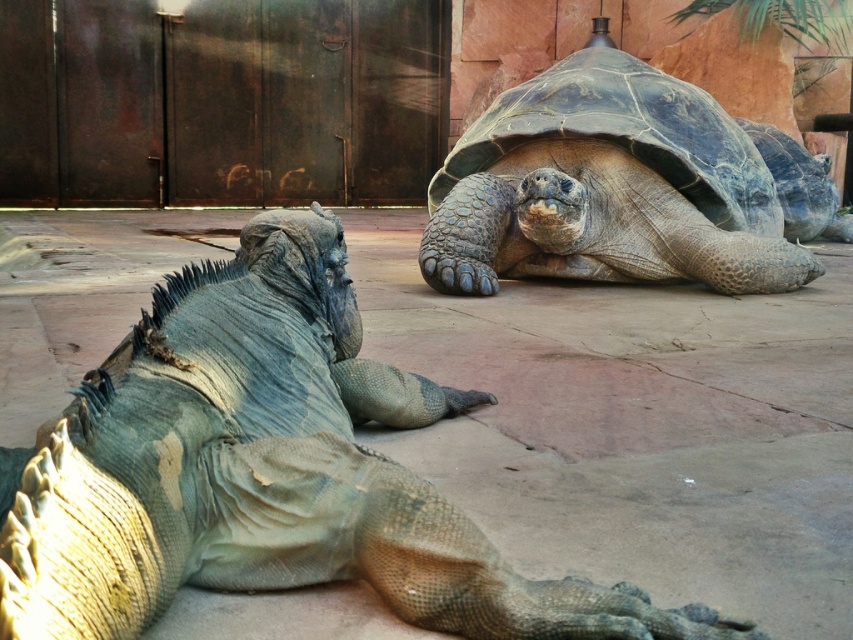
Question: Is the position of dark gray textured tortoise at center less distant than that of shiny dark green tortoise at upper right?

Choices:
 (A) yes
 (B) no

Answer: (A)

Question: Considering the real-world distances, which object is farthest from the scaly gray iguana at center?

Choices:
 (A) shiny dark green tortoise at upper right
 (B) dark gray textured tortoise at center

Answer: (A)

Question: Among these points, which one is farthest from the camera?

Choices:
 (A) (349, 394)
 (B) (534, 248)

Answer: (B)

Question: Considering the relative positions of scaly gray iguana at center and shiny dark green tortoise at upper right in the image provided, where is scaly gray iguana at center located with respect to shiny dark green tortoise at upper right?

Choices:
 (A) above
 (B) below

Answer: (B)

Question: Where is dark gray textured tortoise at center located in relation to shiny dark green tortoise at upper right in the image?

Choices:
 (A) right
 (B) left

Answer: (B)

Question: Based on their relative distances, which object is nearer to the dark gray textured tortoise at center?

Choices:
 (A) shiny dark green tortoise at upper right
 (B) scaly gray iguana at center

Answer: (A)